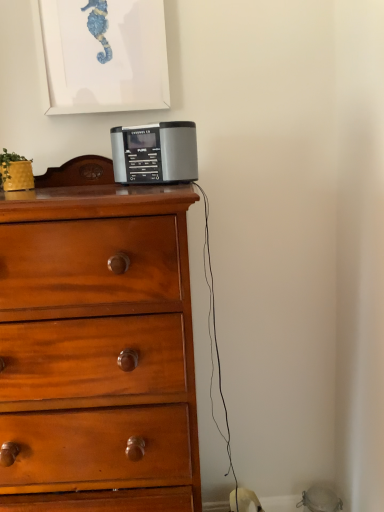
Question: Should I look upward or downward to see silver/black plastic radio at center?

Choices:
 (A) up
 (B) down

Answer: (A)

Question: Can you confirm if silver/black plastic radio at center is smaller than wooden chest of drawers at center?

Choices:
 (A) yes
 (B) no

Answer: (A)

Question: Is silver/black plastic radio at center outside wooden chest of drawers at center?

Choices:
 (A) yes
 (B) no

Answer: (B)

Question: Considering the relative positions of silver/black plastic radio at center and wooden chest of drawers at center in the image provided, is silver/black plastic radio at center to the left of wooden chest of drawers at center from the viewer's perspective?

Choices:
 (A) no
 (B) yes

Answer: (A)

Question: From a real-world perspective, is silver/black plastic radio at center beneath wooden chest of drawers at center?

Choices:
 (A) yes
 (B) no

Answer: (B)

Question: Does silver/black plastic radio at center touch wooden chest of drawers at center?

Choices:
 (A) yes
 (B) no

Answer: (B)

Question: Would you say silver/black plastic radio at center contains wooden chest of drawers at center?

Choices:
 (A) no
 (B) yes

Answer: (A)

Question: Is wooden chest of drawers at center shorter than silver/black plastic radio at center?

Choices:
 (A) yes
 (B) no

Answer: (B)

Question: Is wooden chest of drawers at center not close to silver/black plastic radio at center?

Choices:
 (A) no
 (B) yes

Answer: (A)

Question: From the image's perspective, is wooden chest of drawers at center located beneath silver/black plastic radio at center?

Choices:
 (A) yes
 (B) no

Answer: (A)

Question: Can we say wooden chest of drawers at center lies outside silver/black plastic radio at center?

Choices:
 (A) yes
 (B) no

Answer: (A)

Question: Is wooden chest of drawers at center bigger than silver/black plastic radio at center?

Choices:
 (A) no
 (B) yes

Answer: (B)

Question: Does wooden chest of drawers at center have a greater height compared to silver/black plastic radio at center?

Choices:
 (A) no
 (B) yes

Answer: (B)

Question: From their relative heights in the image, would you say wooden chest of drawers at center is taller or shorter than silver/black plastic radio at center?

Choices:
 (A) short
 (B) tall

Answer: (B)